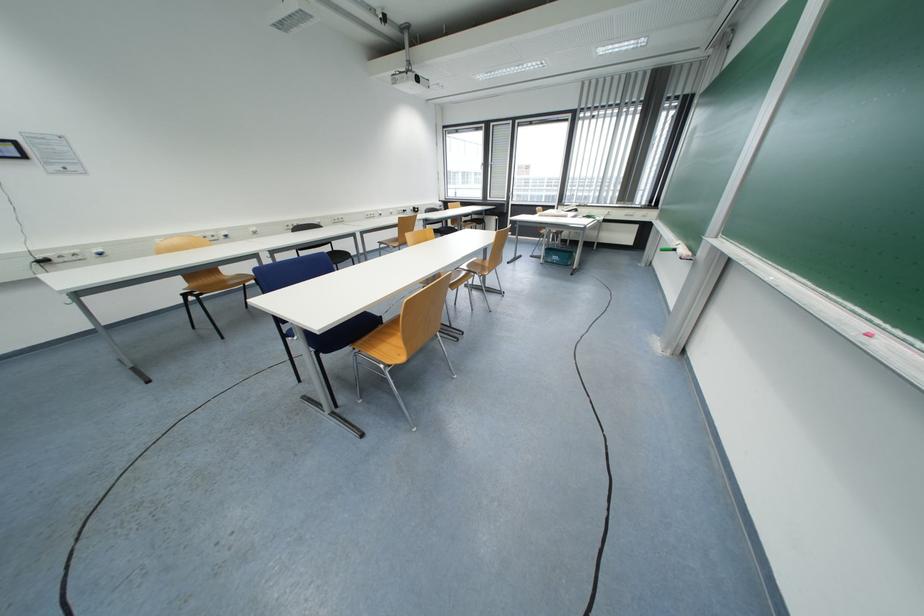
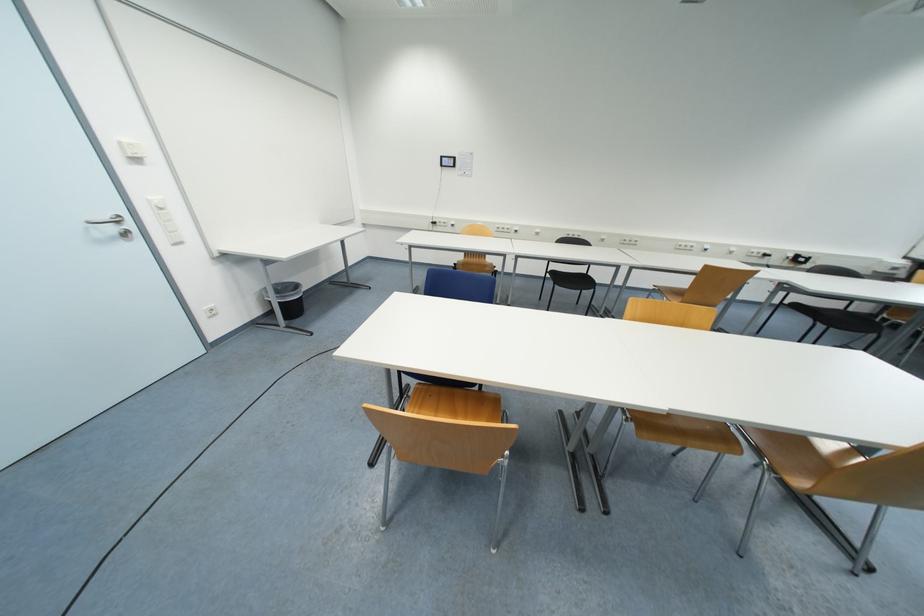
Question: I am providing you with two images of the same scene from different viewpoints. Which of the following objects are not visible in image2?

Choices:
 (A) black chair surface
 (B) white switch button
 (C) sofa caster wheel
 (D) black trash can

Answer: (A)